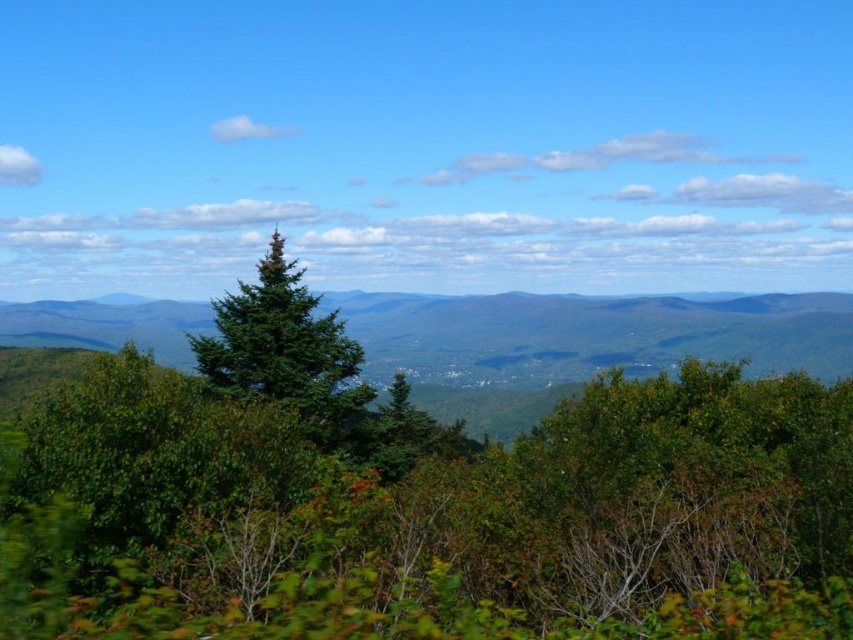
Based on the photo, you are planning to plant a new tree in the valley. You have two options from the image, the green leafy trees at center and the green matte tree at center. Which one has a larger width according to the scene?

The green leafy trees at center might be wider than green matte tree at center, so the green leafy trees at center has a larger width according to the scene.

You are standing in the landscape scene and want to pick a fruit from the green leafy tree at center. Can you reach the fruit without any tools if your maximum arm reach is 2 meters?

The distance between you and the green leafy tree at center is 2.95 meters, which is beyond your 2 meter arm reach. You cannot reach the fruit without tools.